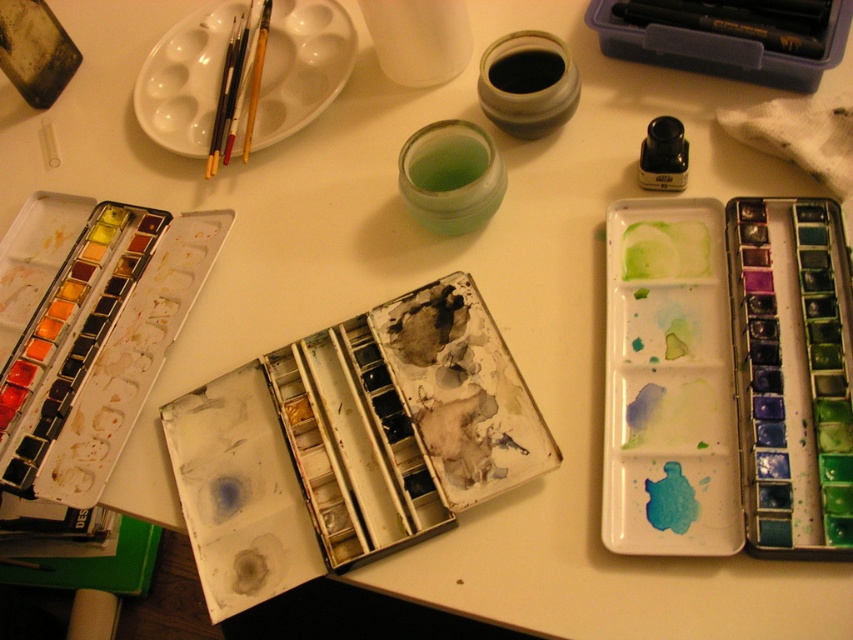
Can you confirm if black plastic pencil at upper right is positioned to the left of yellow wood paint brush at upper left?

Incorrect, black plastic pencil at upper right is not on the left side of yellow wood paint brush at upper left.

Where is `black plastic pencil at upper right`? This screenshot has height=640, width=853. black plastic pencil at upper right is located at coordinates (740, 19).

Where is `black plastic pencil at upper right`? black plastic pencil at upper right is located at coordinates (740, 19).